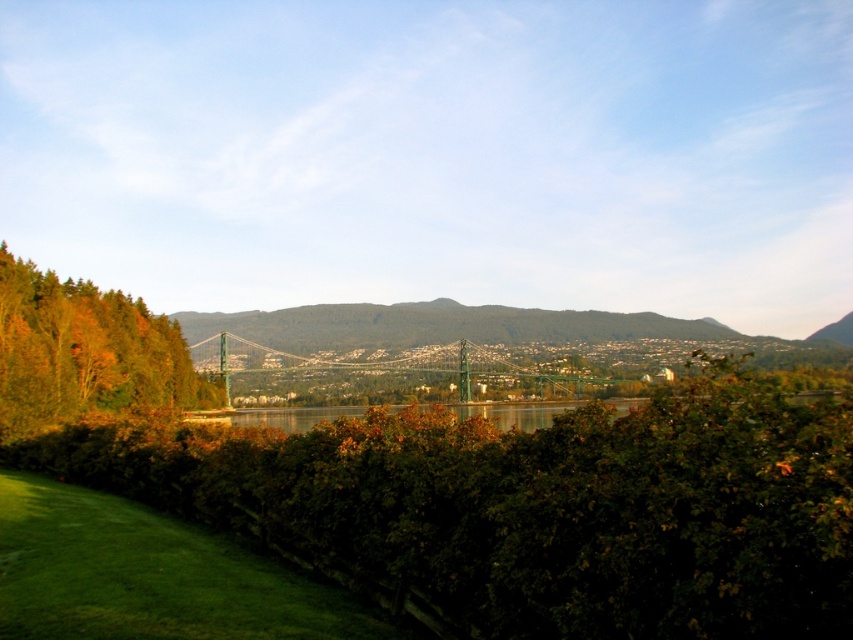
Can you confirm if green leafy hedge at center is positioned to the right of green metallic bridge at center?

In fact, green leafy hedge at center is to the left of green metallic bridge at center.

Is green leafy hedge at center taller than green metallic bridge at center?

No, green leafy hedge at center is not taller than green metallic bridge at center.

Describe the element at coordinates (527, 508) in the screenshot. I see `green leafy hedge at center` at that location.

In order to click on green leafy hedge at center in this screenshot , I will do `click(527, 508)`.

Who is lower down, green metallic bridge at center or greenish reflective water at center?

green metallic bridge at center is lower down.

Between green metallic bridge at center and greenish reflective water at center, which one has less height?

Standing shorter between the two is green metallic bridge at center.

Is point (245, 388) behind point (216, 419)?

Yes, point (245, 388) is behind point (216, 419).

Where is `green metallic bridge at center`? Image resolution: width=853 pixels, height=640 pixels. green metallic bridge at center is located at coordinates (380, 372).

Does point (7, 337) lie behind point (363, 362)?

No.

Is point (122, 320) less distant than point (318, 356)?

Yes, point (122, 320) is closer to viewer.

Locate an element on the screen. The image size is (853, 640). green leafy tree at left is located at coordinates click(84, 353).